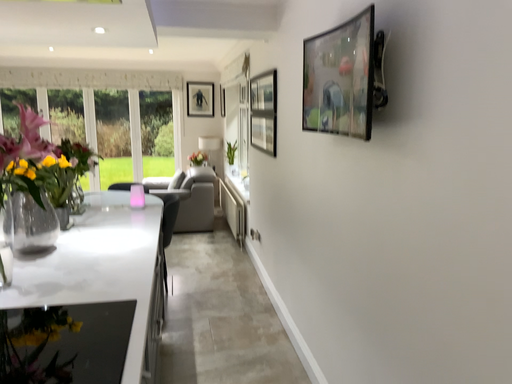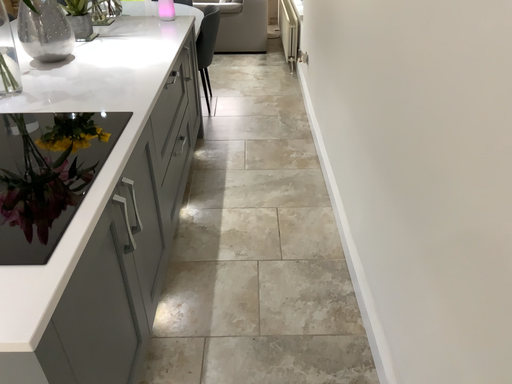
Question: How did the camera likely rotate when shooting the video?

Choices:
 (A) rotated right
 (B) rotated left

Answer: (B)